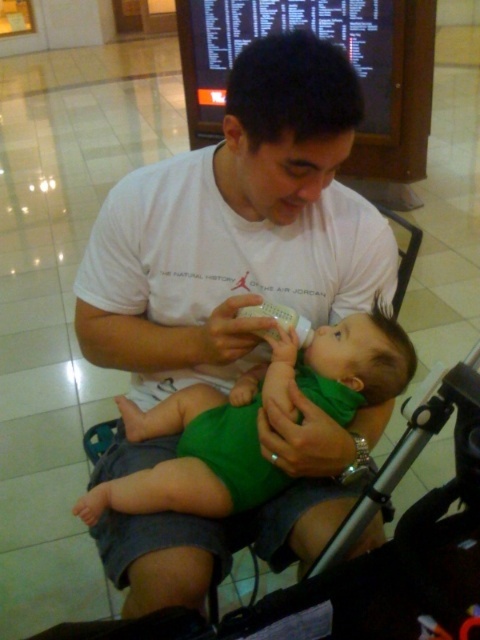
You are a photographer standing at a distance. You want to take a closeup photo of the green fabric baby at center without moving the baby. What is the minimum distance you need to be from the camera to the baby?

The minimum distance required is 34.51 inches because the green fabric baby at center is located exactly 34.51 inches away from the camera.